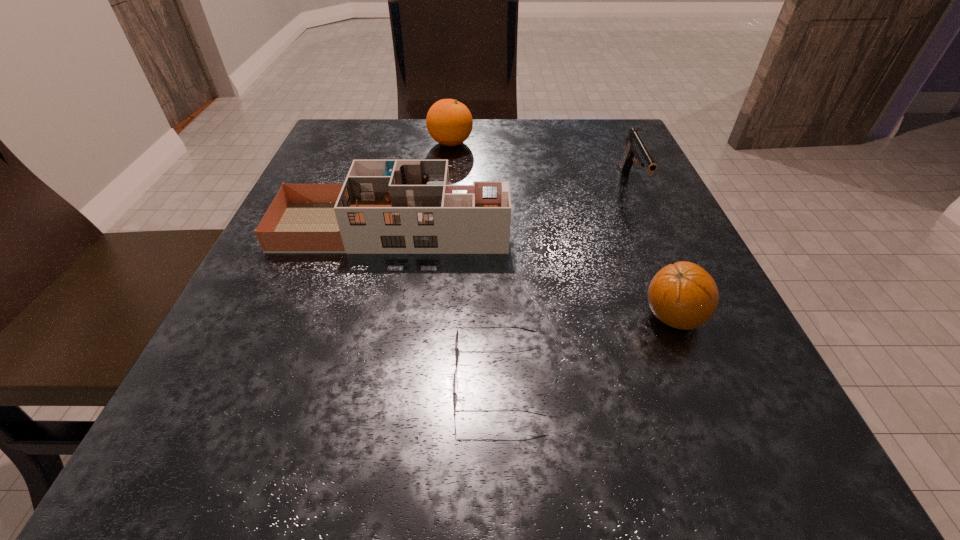
The width and height of the screenshot is (960, 540). Find the location of `free space at the near edge of the desktop`. free space at the near edge of the desktop is located at coordinates (420, 451).

I want to click on vacant space at the right edge, so (664, 333).

I want to click on blank space at the far left corner of the desktop, so click(324, 161).

In the image, there is a desktop. Where is `vacant region at the far right corner`? This screenshot has width=960, height=540. vacant region at the far right corner is located at coordinates (571, 140).

The image size is (960, 540). What are the coordinates of `unoccupied area between the dollhouse and the pistol` in the screenshot? It's located at (512, 206).

Locate an element on the screen. blank region between the right orange and the dollhouse is located at coordinates click(533, 272).

This screenshot has width=960, height=540. I want to click on free space that is in between the pistol and the left orange, so click(x=541, y=164).

Locate an element on the screen. free space between the right orange and the left orange is located at coordinates (562, 230).

What are the coordinates of `vacant space that is in between the dollhouse and the nearer orange` in the screenshot? It's located at (533, 272).

This screenshot has height=540, width=960. Identify the location of empty space between the nearer orange and the farthest object. (562, 230).